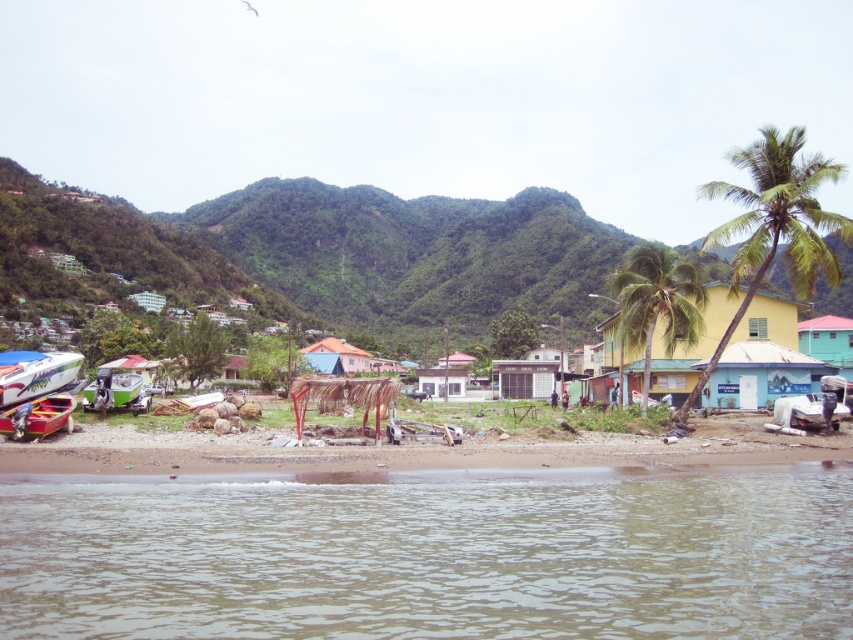
Question: Is green leafy mountain at upper center bigger than shiny white boat at lower left?

Choices:
 (A) yes
 (B) no

Answer: (A)

Question: Does green leafy mountain at upper center come behind shiny white boat at lower left?

Choices:
 (A) no
 (B) yes

Answer: (B)

Question: Which object is the closest to the green leafy palm tree at right?

Choices:
 (A) green leafy mountain at upper center
 (B) yellow matte hut at center-right
 (C) smooth sand beach at lower center
 (D) green corrugated metal hut at right

Answer: (B)

Question: Among these objects, which one is nearest to the camera?

Choices:
 (A) shiny white boat at lower left
 (B) yellow matte hut at center-right
 (C) smooth sand beach at lower center
 (D) green leafy mountain at upper center

Answer: (C)

Question: Which point appears closest to the camera in this image?

Choices:
 (A) (392, 600)
 (B) (659, 332)
 (C) (329, 337)

Answer: (A)

Question: Is green leafy mountain at upper center wider than metallic silver hut at center?

Choices:
 (A) no
 (B) yes

Answer: (B)